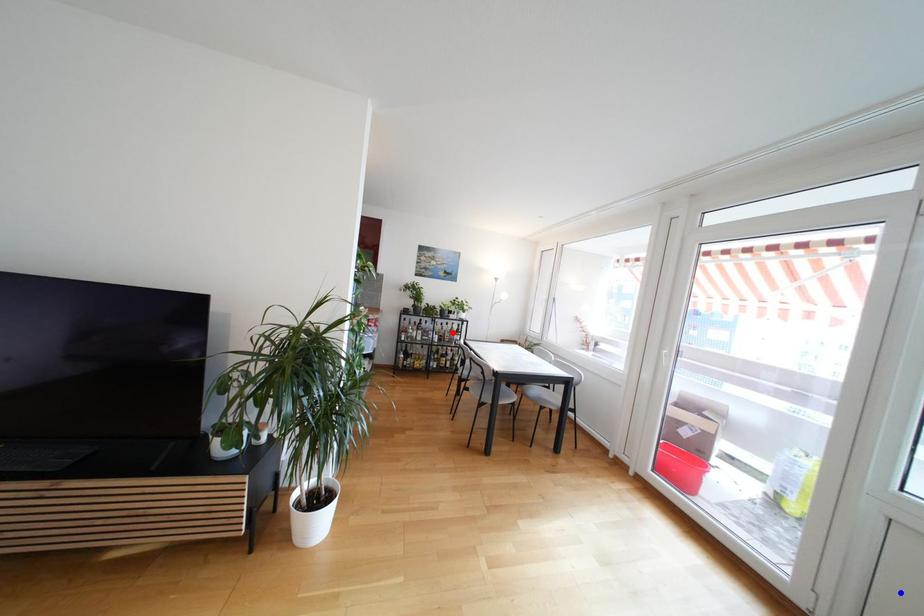
Question: Which of the two points in the image is closer to the camera?

Choices:
 (A) Blue point is closer.
 (B) Red point is closer.

Answer: (A)